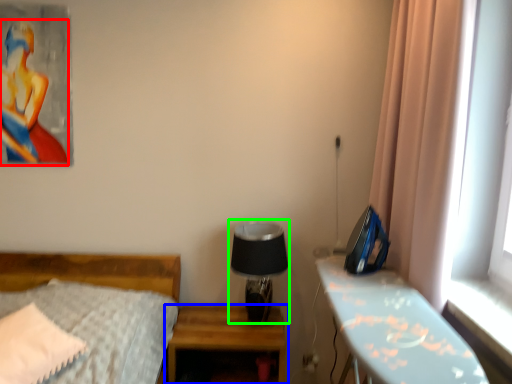
Question: Which object is positioned farthest from woman (highlighted by a red box)? Select from nightstand (highlighted by a blue box) and table lamp (highlighted by a green box).

Choices:
 (A) nightstand
 (B) table lamp

Answer: (A)